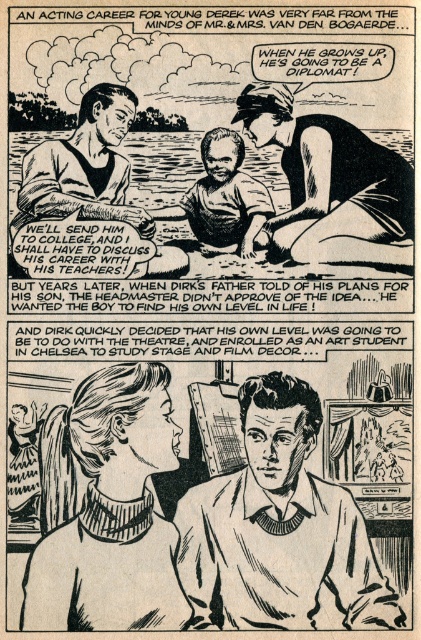
Based on the photo, in the comic strip, the father is wearing a smooth sweater at center, and the mother is wearing a knitted turtleneck sweater at center. Which parent is wearing the wider sweater?

The knitted turtleneck sweater at center is wider than the smooth sweater at center, so the mother is wearing the wider sweater.